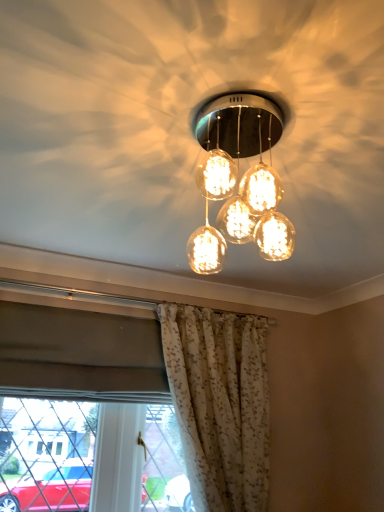
Question: Looking at their shapes, would you say translucent glass globe at center is wider or thinner than white floral fabric curtain at lower center?

Choices:
 (A) thin
 (B) wide

Answer: (B)

Question: Considering the positions of translucent glass globe at center and white floral fabric curtain at lower center in the image, is translucent glass globe at center bigger or smaller than white floral fabric curtain at lower center?

Choices:
 (A) big
 (B) small

Answer: (B)

Question: From the image's perspective, is translucent glass globe at center located above or below white floral fabric curtain at lower center?

Choices:
 (A) above
 (B) below

Answer: (A)

Question: From their relative heights in the image, would you say white floral fabric curtain at lower center is taller or shorter than translucent glass globe at center?

Choices:
 (A) short
 (B) tall

Answer: (B)

Question: From the image's perspective, is white floral fabric curtain at lower center positioned above or below translucent glass globe at center?

Choices:
 (A) above
 (B) below

Answer: (B)

Question: Considering the positions of point (173, 336) and point (243, 109), is point (173, 336) closer or farther from the camera than point (243, 109)?

Choices:
 (A) farther
 (B) closer

Answer: (A)

Question: Looking at their shapes, would you say white floral fabric curtain at lower center is wider or thinner than translucent glass globe at center?

Choices:
 (A) thin
 (B) wide

Answer: (A)